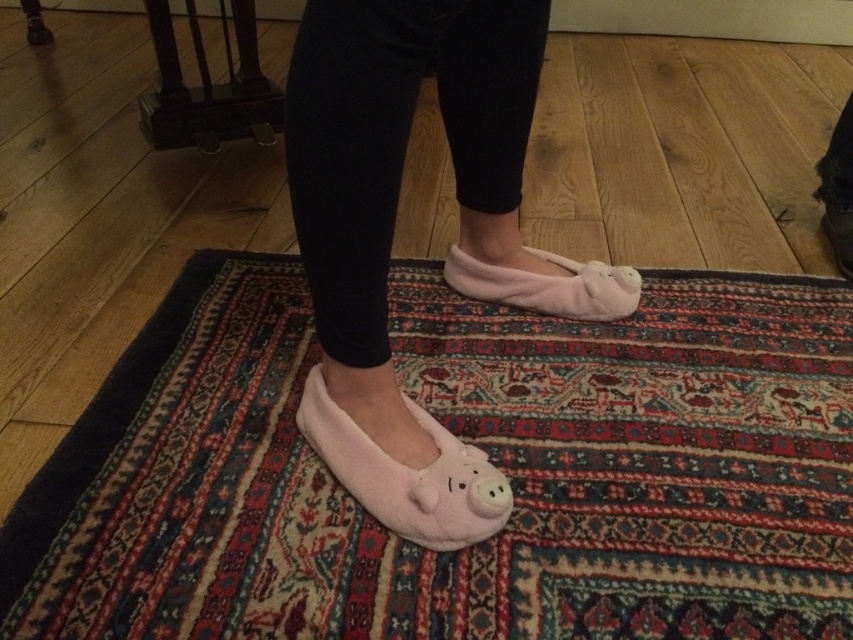
In the scene shown: You are trying to place a new decorative mat at point (392, 234). Is there already an object at that location?

Yes, the pink fuzzy slippers at center is located at point (392, 234).

You are a photographer trying to capture the pink fuzzy slippers at center and the fluffy pink slippers at center in a single shot. Which pair of slippers will appear larger in the photo?

The pink fuzzy slippers at center will appear larger in the photo because they are closer to the viewer than the fluffy pink slippers at center.

You are designing a shoe rack for the fluffy pink slippers at center and the pink fuzzy slipper at lower center. Which one requires a taller space in the rack?

The pink fuzzy slipper at lower center requires a taller space in the rack because it is taller than the fluffy pink slippers at center.